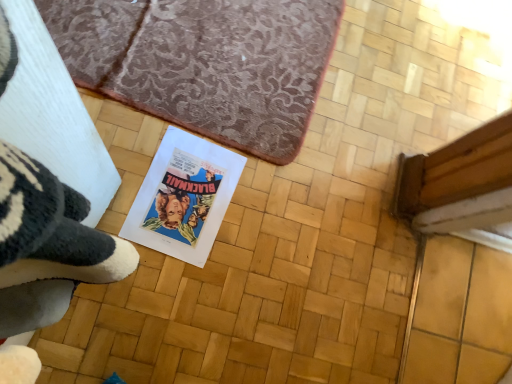
Where is `free point in front of matte paper book at center`? free point in front of matte paper book at center is located at coordinates tap(137, 294).